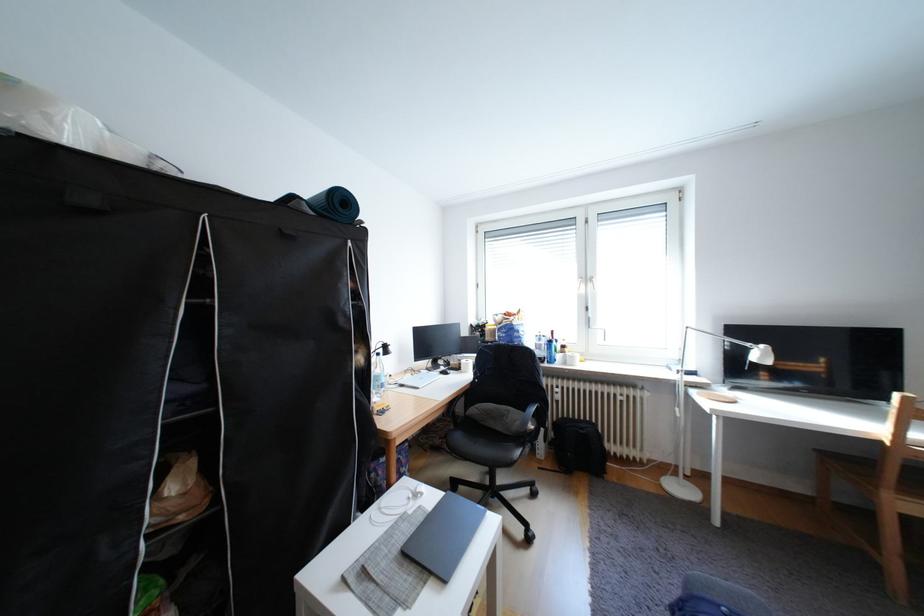
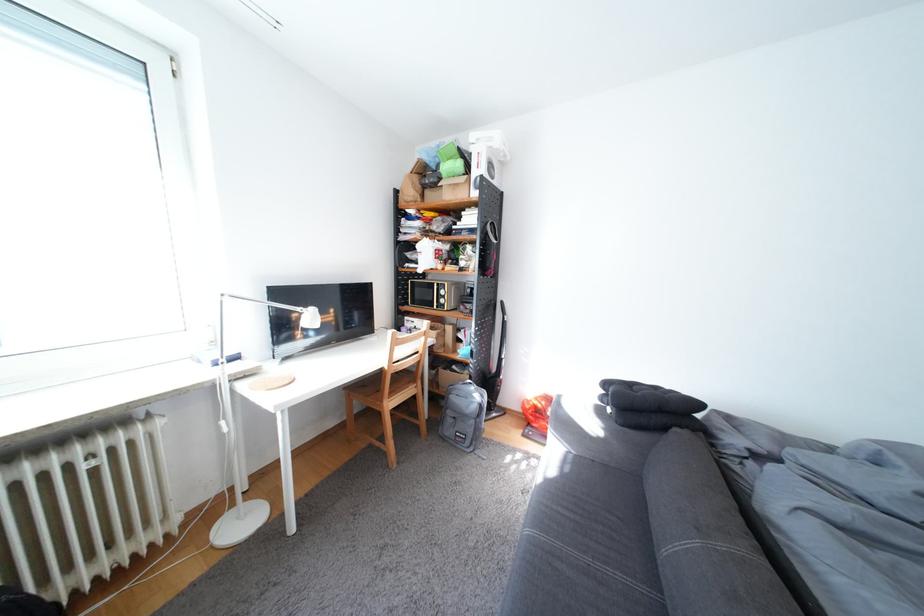
Question: The first image is from the beginning of the video and the second image is from the end. How did the camera likely rotate when shooting the video?

Choices:
 (A) Left
 (B) Right
 (C) Up
 (D) Down

Answer: (B)